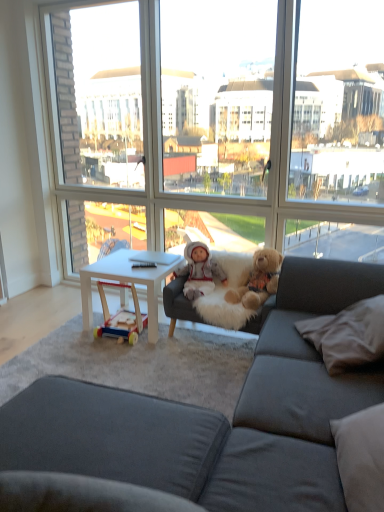
Question: Does white plush doll at center appear on the left side of transparent glass window at center?

Choices:
 (A) yes
 (B) no

Answer: (B)

Question: Can you confirm if white plush doll at center is smaller than transparent glass window at center?

Choices:
 (A) yes
 (B) no

Answer: (A)

Question: From the image's perspective, is white plush doll at center on transparent glass window at center?

Choices:
 (A) no
 (B) yes

Answer: (A)

Question: Can you confirm if white plush doll at center is taller than transparent glass window at center?

Choices:
 (A) no
 (B) yes

Answer: (A)

Question: Could you tell me if white plush doll at center is turned towards transparent glass window at center?

Choices:
 (A) yes
 (B) no

Answer: (B)

Question: From a real-world perspective, is white plush doll at center positioned above or below transparent glass window at center?

Choices:
 (A) above
 (B) below

Answer: (B)

Question: Considering the positions of white plush doll at center and transparent glass window at center in the image, is white plush doll at center taller or shorter than transparent glass window at center?

Choices:
 (A) short
 (B) tall

Answer: (A)

Question: Considering the positions of white plush doll at center and transparent glass window at center in the image, is white plush doll at center wider or thinner than transparent glass window at center?

Choices:
 (A) wide
 (B) thin

Answer: (A)

Question: In the image, is white plush doll at center positioned in front of or behind transparent glass window at center?

Choices:
 (A) front
 (B) behind

Answer: (B)

Question: Would you say transparent glass window at center is inside or outside white plush doll at center?

Choices:
 (A) inside
 (B) outside

Answer: (B)

Question: Considering their positions, is transparent glass window at center located in front of or behind white plush doll at center?

Choices:
 (A) behind
 (B) front

Answer: (B)

Question: Considering the relative positions of transparent glass window at center and white plush doll at center in the image provided, is transparent glass window at center to the left or to the right of white plush doll at center?

Choices:
 (A) right
 (B) left

Answer: (B)

Question: From a real-world perspective, relative to white plush doll at center, is transparent glass window at center vertically above or below?

Choices:
 (A) above
 (B) below

Answer: (A)

Question: Based on their sizes in the image, would you say fluffy brown teddy bear at center is bigger or smaller than transparent glass window at center?

Choices:
 (A) small
 (B) big

Answer: (A)

Question: In terms of height, does fluffy brown teddy bear at center look taller or shorter compared to transparent glass window at center?

Choices:
 (A) short
 (B) tall

Answer: (A)